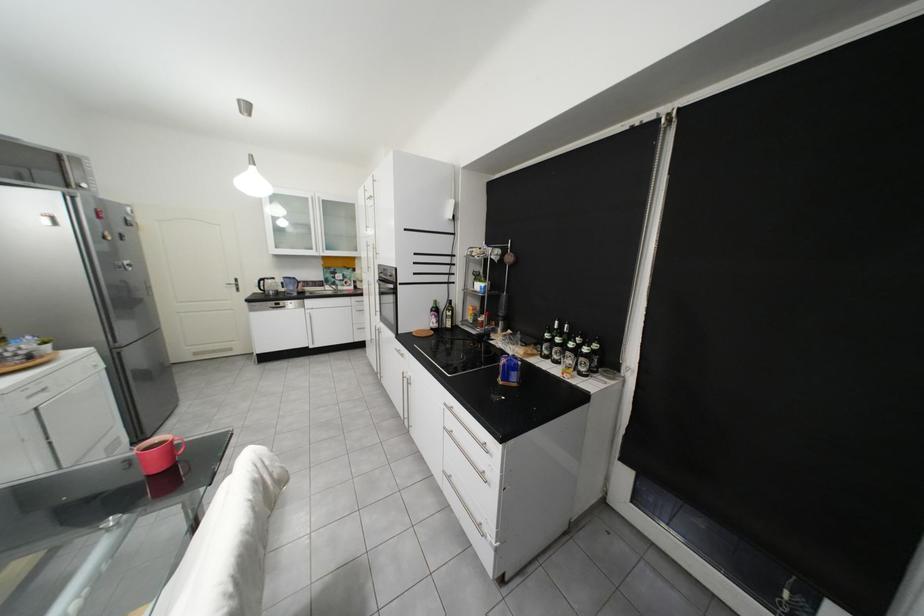
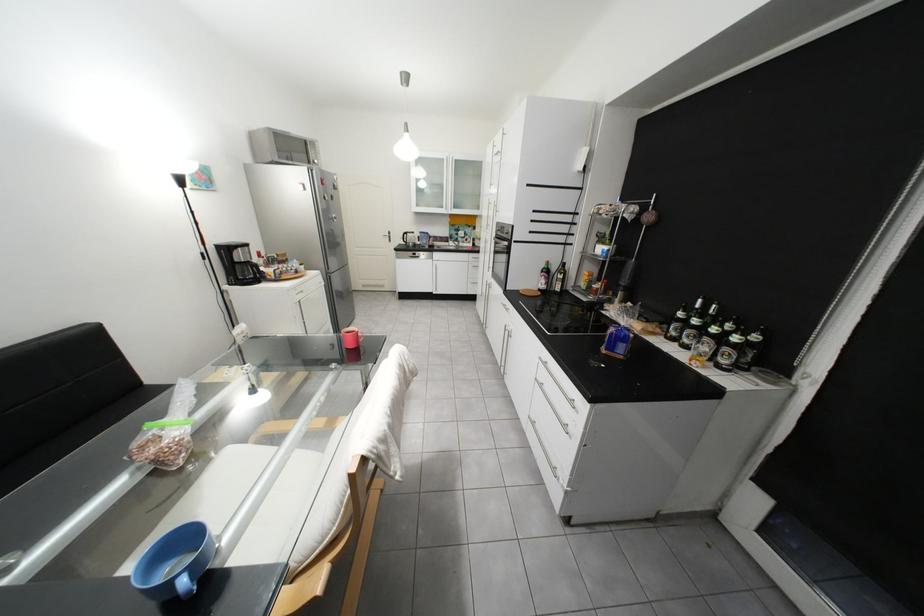
The point at (249, 281) is marked in the first image. Where is the corresponding point in the second image?

(402, 233)